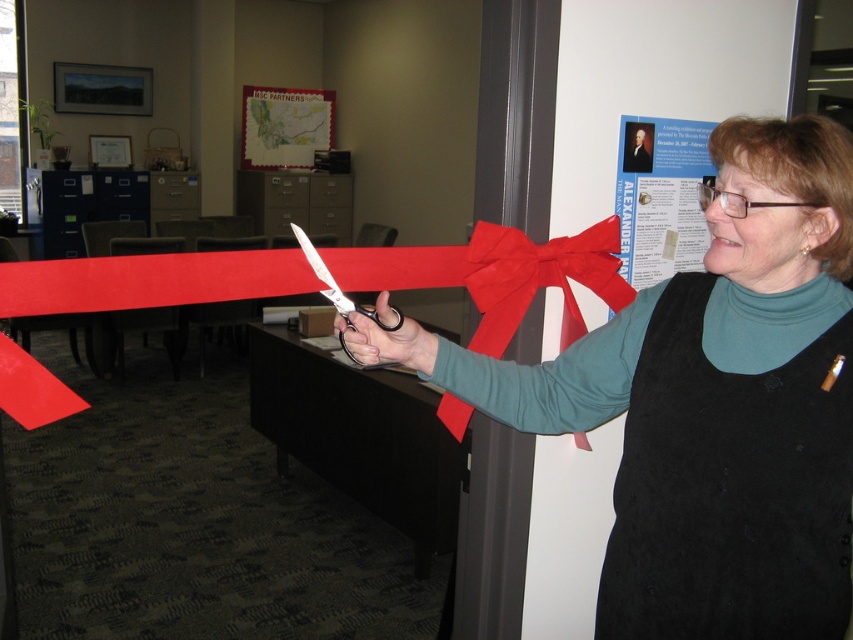
Question: Which point appears farthest from the camera in this image?

Choices:
 (A) (480, 262)
 (B) (747, 349)
 (C) (491, 324)
 (D) (323, 282)

Answer: (C)

Question: Which of the following is the farthest from the observer?

Choices:
 (A) (341, 316)
 (B) (492, 228)

Answer: (B)

Question: Can you confirm if red paper ribbon at center is positioned to the right of metallic scissors at center?

Choices:
 (A) yes
 (B) no

Answer: (A)

Question: Which point appears closest to the camera in this image?

Choices:
 (A) (331, 289)
 (B) (90, 301)
 (C) (463, 429)

Answer: (A)

Question: Does matte black vest at center have a larger size compared to red satin ribbon at center?

Choices:
 (A) yes
 (B) no

Answer: (A)

Question: Can you confirm if red satin ribbon at center is positioned to the right of metallic scissors at center?

Choices:
 (A) yes
 (B) no

Answer: (A)